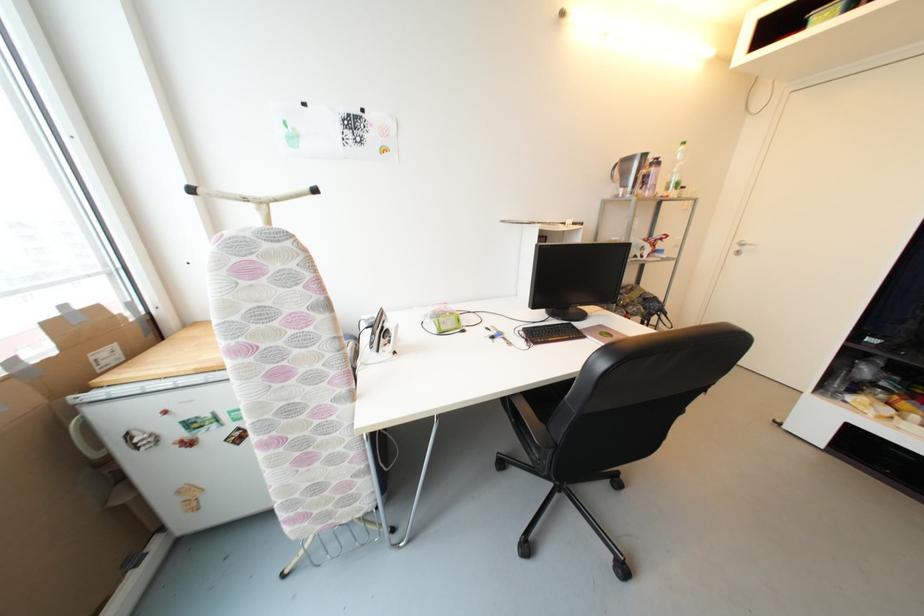
Locate an element on the screen. black chair sitting surface is located at coordinates (549, 398).